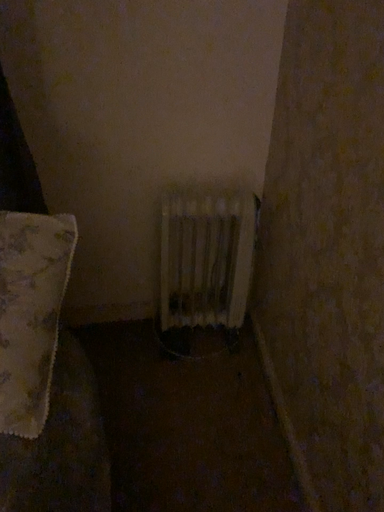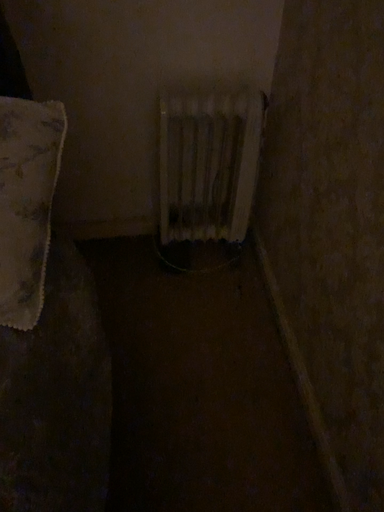
Question: How did the camera likely rotate when shooting the video?

Choices:
 (A) rotated downward
 (B) rotated upward

Answer: (A)